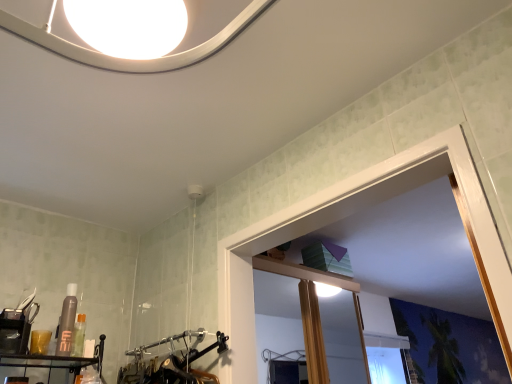
The width and height of the screenshot is (512, 384). What do you see at coordinates (347, 215) in the screenshot? I see `transparent glass window at upper center` at bounding box center [347, 215].

I want to click on transparent glass window at upper center, so click(x=347, y=215).

Locate an element on the screen. The image size is (512, 384). transparent glass window at upper center is located at coordinates (347, 215).